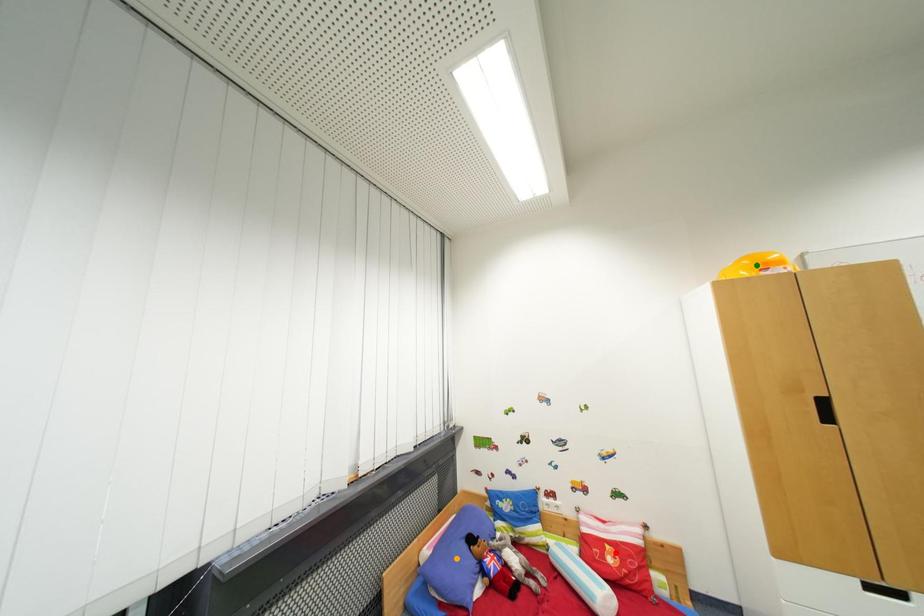
Order these from nearest to farthest:
- green point
- orange point
- red point

green point, red point, orange point